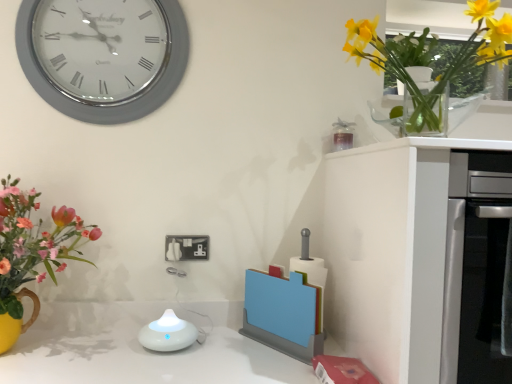
Question: Is white matte cabinet at right taller than yellow glass vase at upper right?

Choices:
 (A) yes
 (B) no

Answer: (A)

Question: Considering the relative sizes of white matte cabinet at right and yellow glass vase at upper right in the image provided, is white matte cabinet at right wider than yellow glass vase at upper right?

Choices:
 (A) yes
 (B) no

Answer: (A)

Question: Is white matte cabinet at right at the right side of yellow glass vase at upper right?

Choices:
 (A) no
 (B) yes

Answer: (B)

Question: Is white matte cabinet at right positioned behind yellow glass vase at upper right?

Choices:
 (A) yes
 (B) no

Answer: (A)

Question: Are white matte cabinet at right and yellow glass vase at upper right making contact?

Choices:
 (A) yes
 (B) no

Answer: (B)

Question: Looking at the image, does silver metallic clock at upper left seem bigger or smaller compared to yellow glass vase at upper right?

Choices:
 (A) big
 (B) small

Answer: (B)

Question: Is silver metallic clock at upper left spatially inside yellow glass vase at upper right, or outside of it?

Choices:
 (A) inside
 (B) outside

Answer: (B)

Question: In the image, is silver metallic clock at upper left on the left side or the right side of yellow glass vase at upper right?

Choices:
 (A) left
 (B) right

Answer: (A)

Question: Is point (178, 4) closer or farther from the camera than point (364, 56)?

Choices:
 (A) closer
 (B) farther

Answer: (B)

Question: In terms of height, does yellow glass vase at upper right look taller or shorter compared to white plastic electrical outlet at center?

Choices:
 (A) short
 (B) tall

Answer: (B)

Question: In terms of size, does yellow glass vase at upper right appear bigger or smaller than white plastic electrical outlet at center?

Choices:
 (A) small
 (B) big

Answer: (B)

Question: Is yellow glass vase at upper right in front of or behind white plastic electrical outlet at center in the image?

Choices:
 (A) front
 (B) behind

Answer: (A)

Question: From a real-world perspective, is yellow glass vase at upper right above or below white plastic electrical outlet at center?

Choices:
 (A) below
 (B) above

Answer: (B)

Question: Is silver metallic clock at upper left situated inside white glossy diffuser at center or outside?

Choices:
 (A) outside
 (B) inside

Answer: (A)

Question: From the image's perspective, is silver metallic clock at upper left above or below white glossy diffuser at center?

Choices:
 (A) above
 (B) below

Answer: (A)